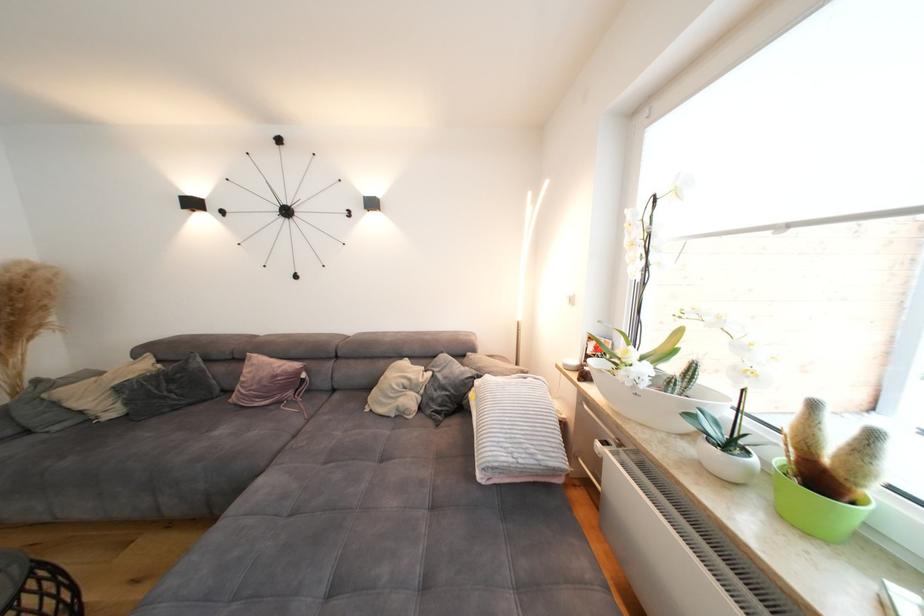
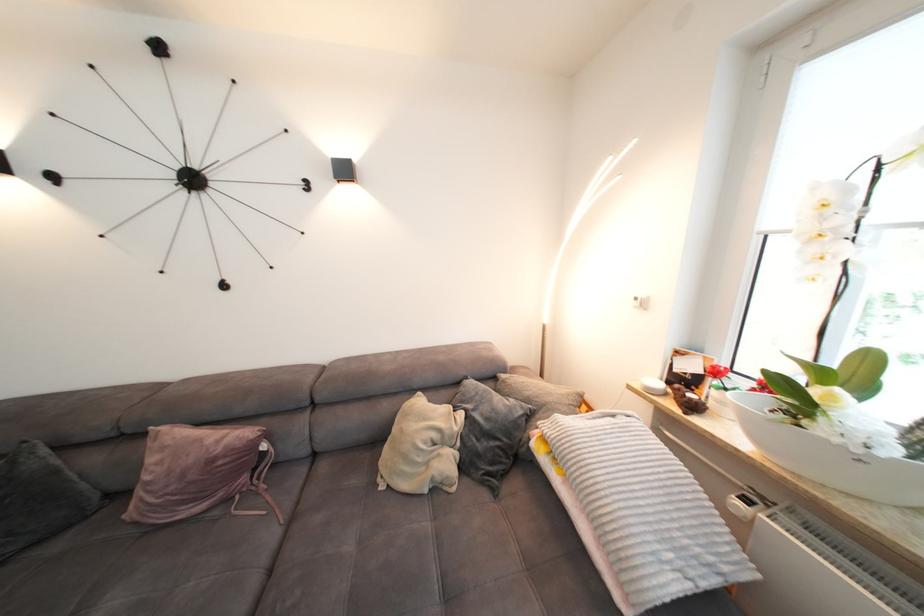
Where in the second image is the point corresponding to point 261,367 from the first image?

(171, 448)